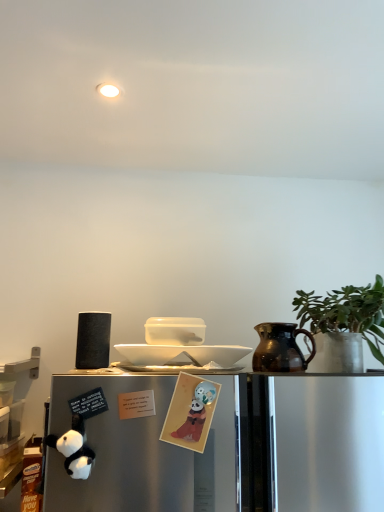
Identify the location of green matte plant at right. (344, 325).

What do you see at coordinates (280, 348) in the screenshot?
I see `brown glazed jug at right` at bounding box center [280, 348].

This screenshot has width=384, height=512. I want to click on brown glazed jug at right, so click(280, 348).

The width and height of the screenshot is (384, 512). Describe the element at coordinates (182, 351) in the screenshot. I see `white glossy plate at center` at that location.

Image resolution: width=384 pixels, height=512 pixels. Describe the element at coordinates (93, 340) in the screenshot. I see `matte black speaker at left` at that location.

This screenshot has width=384, height=512. Describe the element at coordinates (74, 449) in the screenshot. I see `white plush panda at lower left, which is counted as the first toy, starting from the left` at that location.

You are a GUI agent. You are given a task and a screenshot of the screen. Output one action in this format:
    pyautogui.click(x=<x>, y=<y>)
    Task: Click on the green matte plant at right
    
    Given the screenshot: What is the action you would take?
    pyautogui.click(x=344, y=325)

From a real-world perspective, does matte paper card at center, which appears as the first toy when viewed from the right, stand above white glossy plate at center?

Incorrect, from a real-world perspective, matte paper card at center, which appears as the first toy when viewed from the right, is lower than white glossy plate at center.

Can you confirm if matte paper card at center, which appears as the first toy when viewed from the right, is wider than white glossy plate at center?

No.

Is matte paper card at center, which appears as the first toy when viewed from the right, inside the boundaries of white glossy plate at center, or outside?

matte paper card at center, which appears as the first toy when viewed from the right, is located beyond the bounds of white glossy plate at center.

From the image's perspective, is matte paper card at center, which is the 2th toy from left to right, beneath white glossy plate at center?

Yes.

Is there a large distance between white glossy plate at center and matte paper card at center, which is the 2th toy from left to right?

No.

Which is more to the right, white glossy plate at center or matte paper card at center, which appears as the first toy when viewed from the right?

matte paper card at center, which appears as the first toy when viewed from the right, is more to the right.

Can you confirm if white glossy plate at center is smaller than matte paper card at center, which appears as the first toy when viewed from the right?

Actually, white glossy plate at center might be larger than matte paper card at center, which appears as the first toy when viewed from the right.

Choose the correct answer: Is white glossy plate at center inside matte paper card at center, which is the 2th toy from left to right, or outside it?

white glossy plate at center is outside matte paper card at center, which is the 2th toy from left to right.

Looking at this image, between white glossy plate at center and brown glazed jug at right, which one has less height?

white glossy plate at center.

From the image's perspective, is white glossy plate at center under brown glazed jug at right?

Yes, from the image's perspective, white glossy plate at center is below brown glazed jug at right.

Consider the image. From a real-world perspective, is white glossy plate at center physically located above or below brown glazed jug at right?

Clearly, from a real-world perspective, white glossy plate at center is below brown glazed jug at right.

From the picture: Is white glossy plate at center wider or thinner than brown glazed jug at right?

In the image, white glossy plate at center appears to be wider than brown glazed jug at right.

From a real-world perspective, is white glossy plate at center positioned over white plush panda at lower left, the 2th toy when ordered from right to left, based on gravity?

Indeed, from a real-world perspective, white glossy plate at center stands above white plush panda at lower left, the 2th toy when ordered from right to left.

Is white glossy plate at center not near white plush panda at lower left, which is counted as the first toy, starting from the left?

No, white glossy plate at center is not far away from white plush panda at lower left, which is counted as the first toy, starting from the left.

Which is closer to the camera, [75,442] or [329,361]?

Clearly, point [75,442] is closer to the camera than point [329,361].

Between white plush panda at lower left, the 2th toy when ordered from right to left, and green matte plant at right, which one has larger size?

green matte plant at right.

Are white plush panda at lower left, the 2th toy when ordered from right to left, and green matte plant at right making contact?

No, white plush panda at lower left, the 2th toy when ordered from right to left, is not making contact with green matte plant at right.

From a real-world perspective, is white plush panda at lower left, which is counted as the first toy, starting from the left, positioned over green matte plant at right based on gravity?

No.

Is white plush panda at lower left, which is counted as the first toy, starting from the left, surrounded by matte black speaker at left?

No.

Is point (79, 336) less distant than point (68, 447)?

No, (79, 336) is behind (68, 447).

Considering the relative sizes of matte black speaker at left and white plush panda at lower left, the 2th toy when ordered from right to left, in the image provided, is matte black speaker at left smaller than white plush panda at lower left, the 2th toy when ordered from right to left,?

No.

Can you confirm if matte black speaker at left is wider than white plush panda at lower left, which is counted as the first toy, starting from the left?

Yes, matte black speaker at left is wider than white plush panda at lower left, which is counted as the first toy, starting from the left.

Considering the relative sizes of white plush panda at lower left, which is counted as the first toy, starting from the left, and matte black speaker at left in the image provided, is white plush panda at lower left, which is counted as the first toy, starting from the left, bigger than matte black speaker at left?

No, white plush panda at lower left, which is counted as the first toy, starting from the left, is not bigger than matte black speaker at left.

Are white plush panda at lower left, the 2th toy when ordered from right to left, and matte black speaker at left making contact?

white plush panda at lower left, the 2th toy when ordered from right to left, and matte black speaker at left are not in contact.

In the scene shown: Is white plush panda at lower left, which is counted as the first toy, starting from the left, closer to camera compared to matte black speaker at left?

Yes, it is in front of matte black speaker at left.

Find the location of `toy on the right of white glossy plate at center`. toy on the right of white glossy plate at center is located at coordinates (196, 413).

There is a matte paper card at center, which is the 2th toy from left to right. Identify the location of plate above it (from a real-world perspective). The width and height of the screenshot is (384, 512). (182, 351).

Based on their spatial positions, is matte black speaker at left or brown glazed jug at right closer to white glossy plate at center?

brown glazed jug at right is closer to white glossy plate at center.

Looking at the image, which one is located further to white glossy plate at center, green matte plant at right or white plush panda at lower left, which is counted as the first toy, starting from the left?

white plush panda at lower left, which is counted as the first toy, starting from the left.

Which object lies nearer to the anchor point green matte plant at right, matte paper card at center, which appears as the first toy when viewed from the right, or white glossy plate at center?

white glossy plate at center lies closer to green matte plant at right than the other object.

From the picture: When comparing their distances from brown glazed jug at right, does matte black speaker at left or white glossy plate at center seem closer?

white glossy plate at center lies closer to brown glazed jug at right than the other object.

From the picture: Estimate the real-world distances between objects in this image. Which object is further from matte black speaker at left, white plush panda at lower left, the 2th toy when ordered from right to left, or brown glazed jug at right?

Among the two, brown glazed jug at right is located further to matte black speaker at left.

Looking at the image, which one is located further to white glossy plate at center, green matte plant at right or matte black speaker at left?

green matte plant at right lies further to white glossy plate at center than the other object.

Looking at this image, estimate the real-world distances between objects in this image. Which object is further from brown glazed jug at right, matte paper card at center, which is the 2th toy from left to right, or white glossy plate at center?

Based on the image, matte paper card at center, which is the 2th toy from left to right, appears to be further to brown glazed jug at right.

Considering their positions, is matte black speaker at left positioned further to white glossy plate at center than green matte plant at right?

green matte plant at right lies further to white glossy plate at center than the other object.

Where is `plate between white plush panda at lower left, the 2th toy when ordered from right to left, and brown glazed jug at right`? The height and width of the screenshot is (512, 384). plate between white plush panda at lower left, the 2th toy when ordered from right to left, and brown glazed jug at right is located at coordinates (182, 351).

Image resolution: width=384 pixels, height=512 pixels. What are the coordinates of `jug located between white glossy plate at center and green matte plant at right in the left-right direction` in the screenshot? It's located at (280, 348).

Identify the location of toy between matte black speaker at left and matte paper card at center, which appears as the first toy when viewed from the right, from left to right. This screenshot has width=384, height=512. (74, 449).

Locate an element on the screen. jug between matte black speaker at left and green matte plant at right in the horizontal direction is located at coordinates (280, 348).